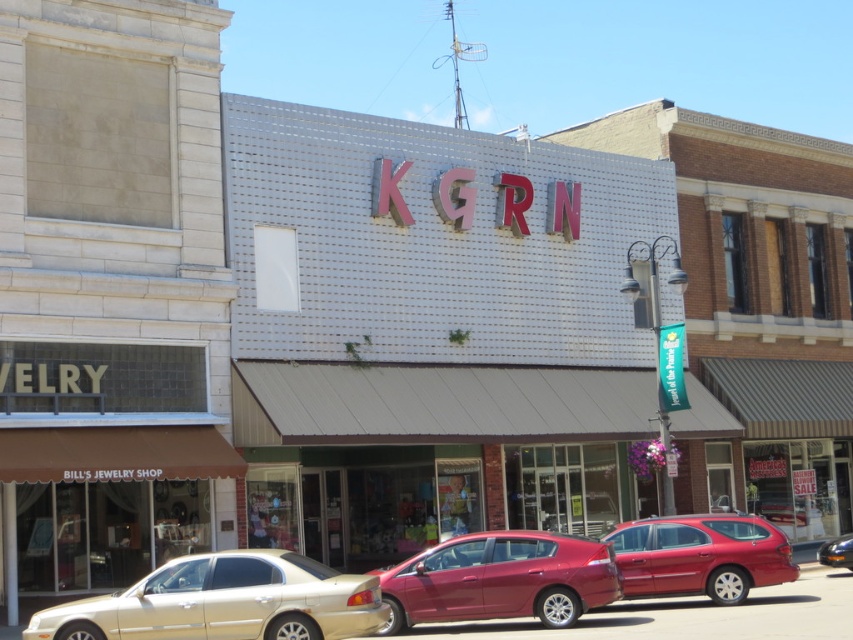
Which is more to the left, metallic red station wagon at center or shiny black sedan at lower right?

metallic red station wagon at center

Describe the element at coordinates (700, 556) in the screenshot. The image size is (853, 640). I see `metallic red station wagon at center` at that location.

Find the location of a particular element. metallic red station wagon at center is located at coordinates (700, 556).

Is point (334, 573) less distant than point (483, 605)?

Yes, it is.

Who is more distant from viewer, (62, 609) or (519, 529)?

Positioned behind is point (519, 529).

In order to click on gold metallic sedan at lower left in this screenshot , I will do `click(225, 602)`.

Does glossy red sedan at center have a greater width compared to shiny black sedan at lower right?

No.

Looking at this image, can you confirm if glossy red sedan at center is positioned above shiny black sedan at lower right?

Yes.

Between point (466, 572) and point (848, 536), which one is positioned in front?

Point (466, 572) is more forward.

Image resolution: width=853 pixels, height=640 pixels. I want to click on glossy red sedan at center, so click(502, 579).